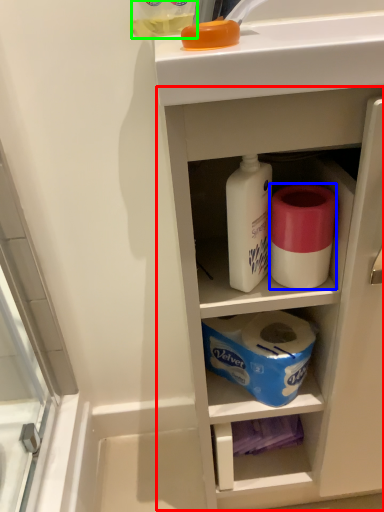
Question: Which object is positioned closest to cabinetry (highlighted by a red box)? Select from toilet paper (highlighted by a blue box) and bottle (highlighted by a green box).

Choices:
 (A) toilet paper
 (B) bottle

Answer: (A)